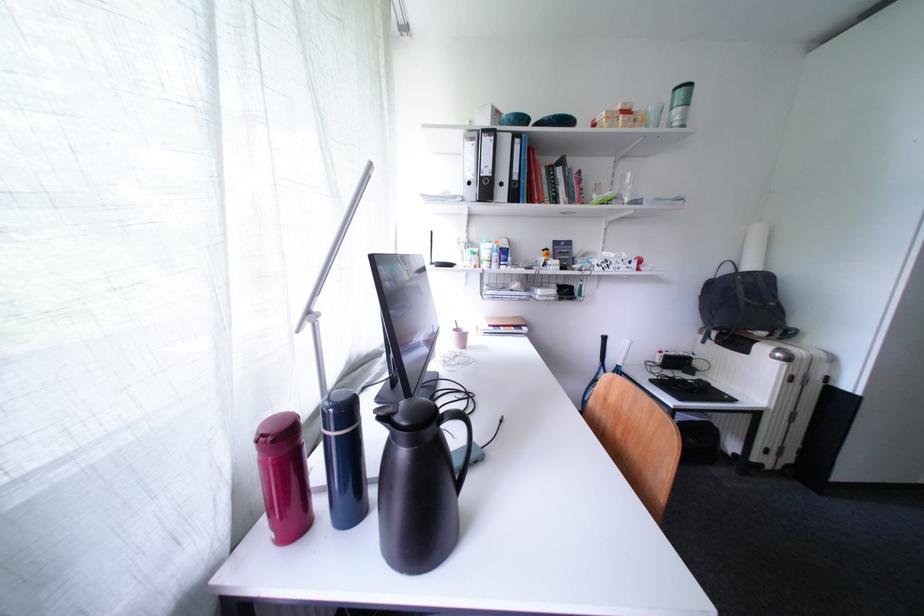
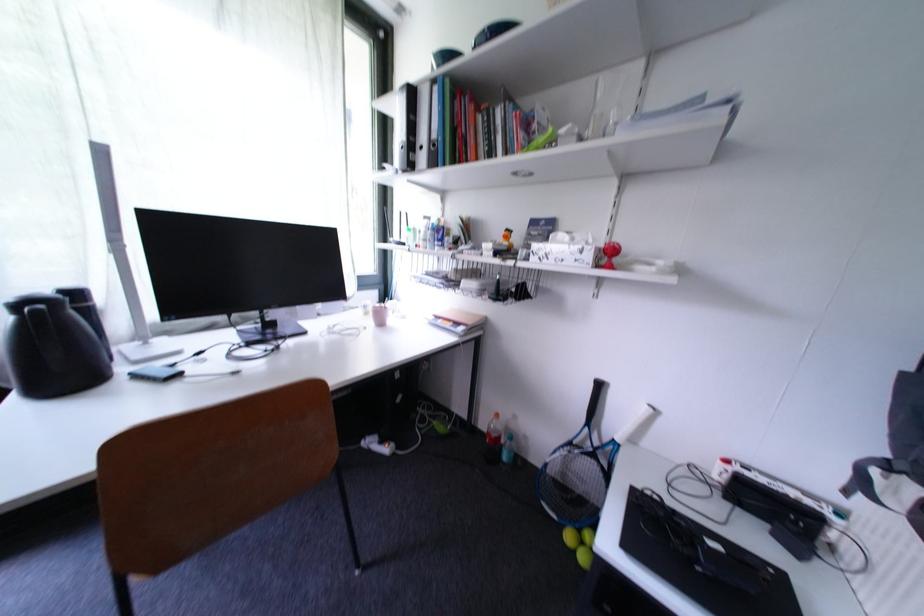
The point at (526, 144) is marked in the first image. Where is the corresponding point in the second image?

(444, 91)